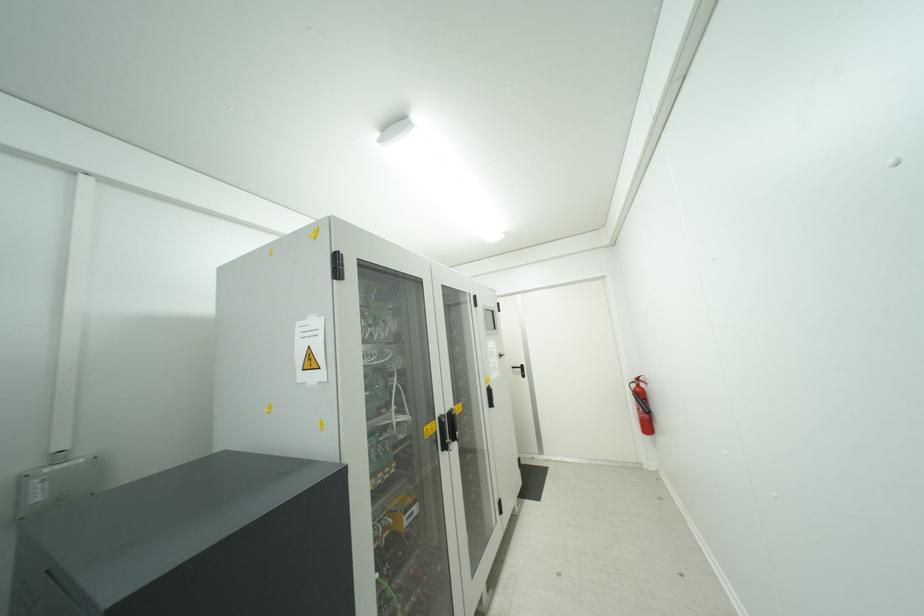
What do you see at coordinates (446, 429) in the screenshot?
I see `the black cabinet handle` at bounding box center [446, 429].